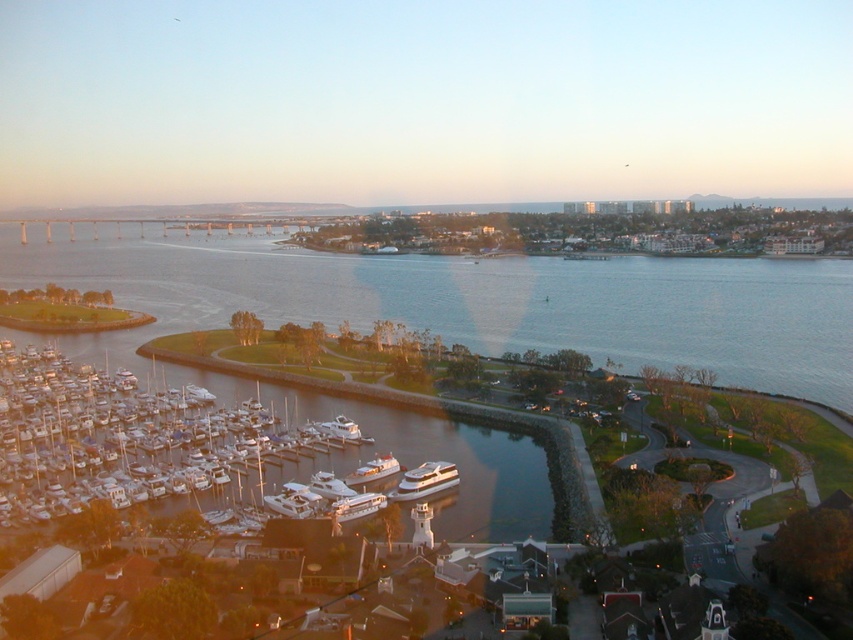
You are standing on the grassy area near the marina and want to take a photo of the white glossy boat at lower center without the blue water at center in the frame. Is it possible to do so?

The blue water at center is positioned over the white glossy boat at lower center, so taking a photo of the white glossy boat at lower center without the blue water at center in the frame would not be possible as the water is covering the boat.

You are standing at the edge of the marina and want to take a photo of both the white glossy boats at lower left and the white glossy boat at center. Which boat should you position yourself closer to in order to include both in your camera frame without moving your position?

You should position yourself closer to the white glossy boats at lower left because they are to the left of the white glossy boat at center, so by centering your frame on them, you can capture both in the shot.

You are a photographer standing at the edge of the marina, wanting to capture both the white glossy boats at lower left and the white glossy yacht at center in a single shot. Based on their positions, which one would appear closer to you in the photo?

The white glossy boats at lower left would appear closer to you in the photo since they are positioned in front of the white glossy yacht at center.